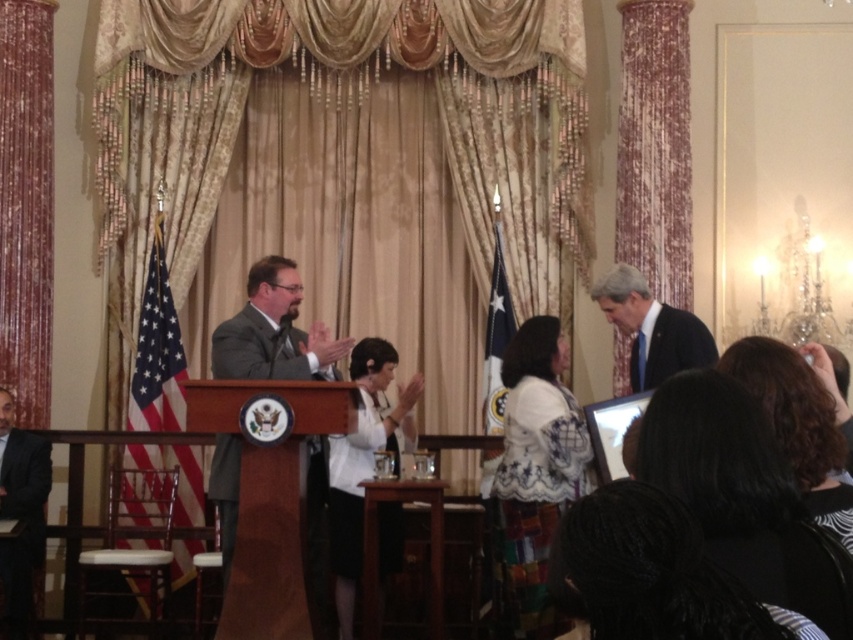
Question: Does velvet-like burgundy curtain at right come behind blue silk suit at right?

Choices:
 (A) yes
 (B) no

Answer: (A)

Question: Among these objects, which one is farthest from the camera?

Choices:
 (A) black suit at lower left
 (B) velvet-like burgundy curtain at right
 (C) gray suit at center

Answer: (B)

Question: Is white matte blazer at center bigger than black suit at lower left?

Choices:
 (A) yes
 (B) no

Answer: (A)

Question: Does gold fabric curtain at center appear under blue silk suit at right?

Choices:
 (A) no
 (B) yes

Answer: (A)

Question: Which object is positioned closest to the black suit at lower left?

Choices:
 (A) gold fabric curtain at center
 (B) velvet-like burgundy curtain at right

Answer: (A)

Question: Based on their relative distances, which object is nearer to the blue silk suit at right?

Choices:
 (A) black suit at lower left
 (B) velvet-like burgundy curtain at right

Answer: (B)